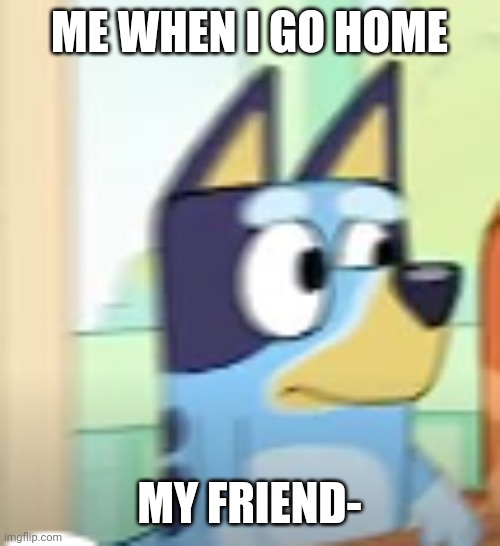
Where is `light pink wall`? light pink wall is located at coordinates (29, 90).